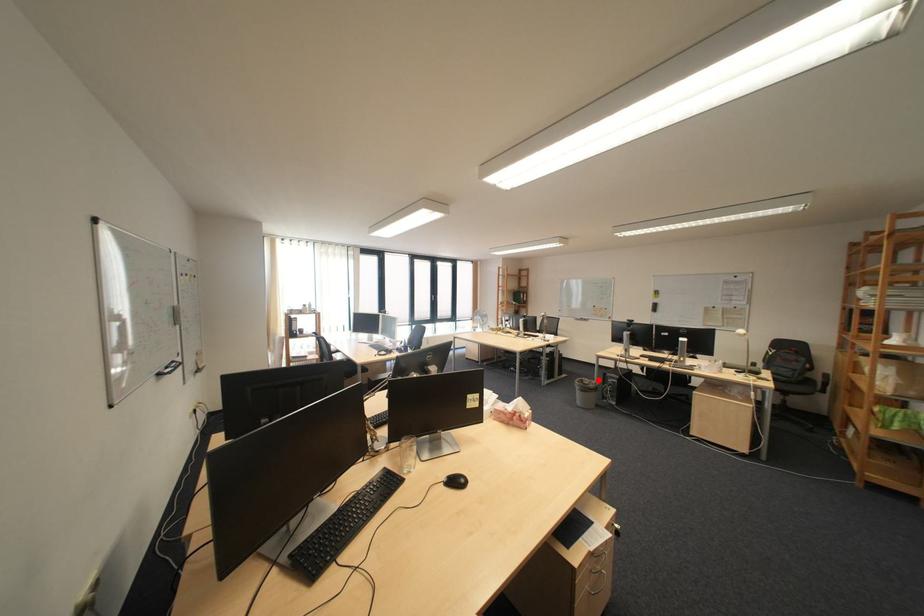
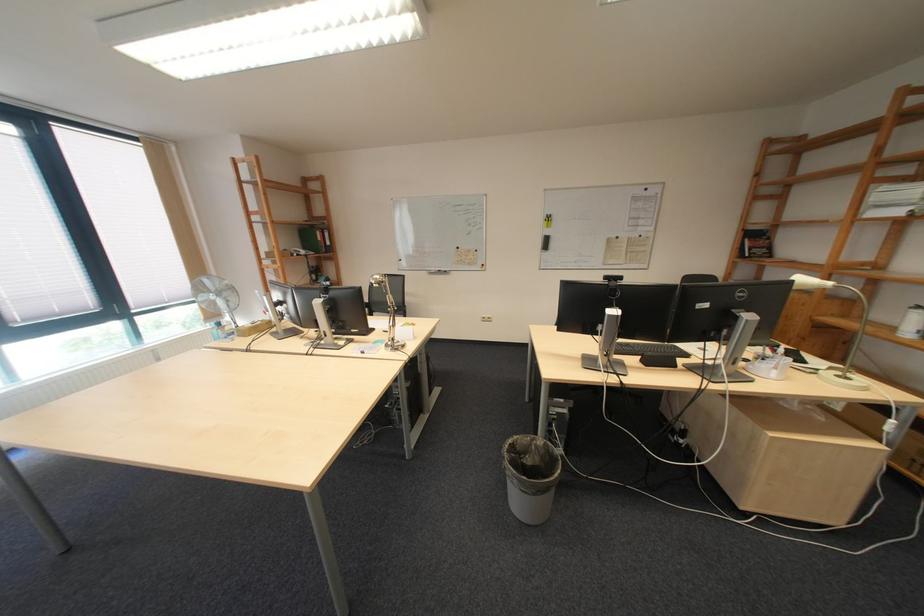
In the second image, find the point that corresponds to the highlighted location in the first image.

(529, 439)